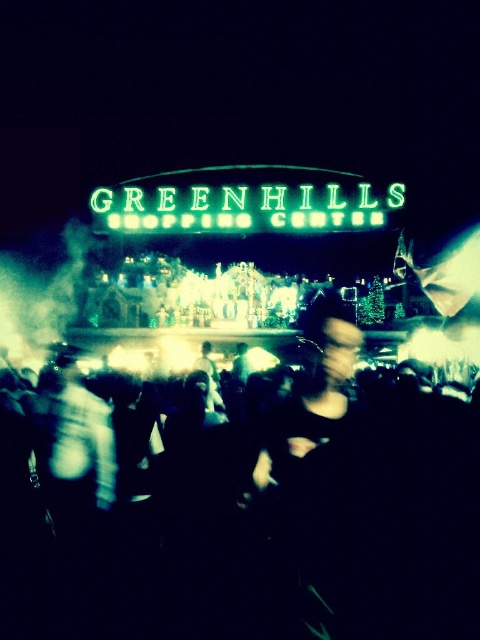
You are standing at the entrance of the Greenhills Shopping Center and notice the black matte crowd at center. Where exactly is the crowd positioned relative to the entrance?

The black matte crowd at center is located at point coordinates (x=264, y=513) relative to the entrance, which places it at the center area of the shopping center.

You are a photographer standing at the entrance of the Greenhills Shopping Center. You want to take a photo of the neon green sign at center without including the black matte crowd at center in the frame. Based on their positions, is this possible?

The black matte crowd at center is to the left of the neon green sign at center. Since the crowd is to the left of the sign, you can position yourself to the right side of the crowd to capture the neon green sign at center without including the black matte crowd at center in the frame.

You are standing at the Greenhills Shopping Center entrance and want to reach the point marked at coordinates (147, 547). Considering the crowd movement, which direction should you move to get there?

The point at coordinates (147, 547) is 131.80 meters away from you, so you should move forward in the direction of the crowd towards it.